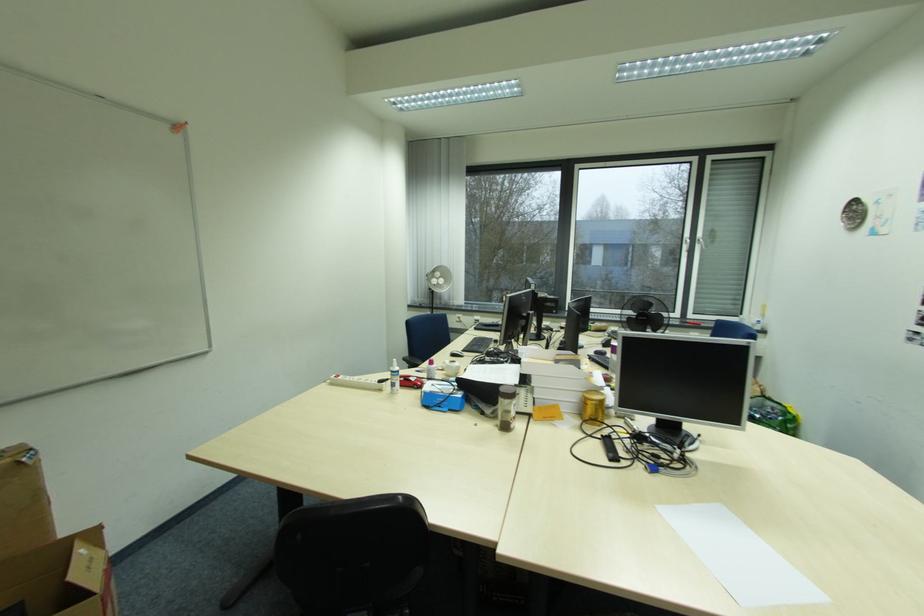
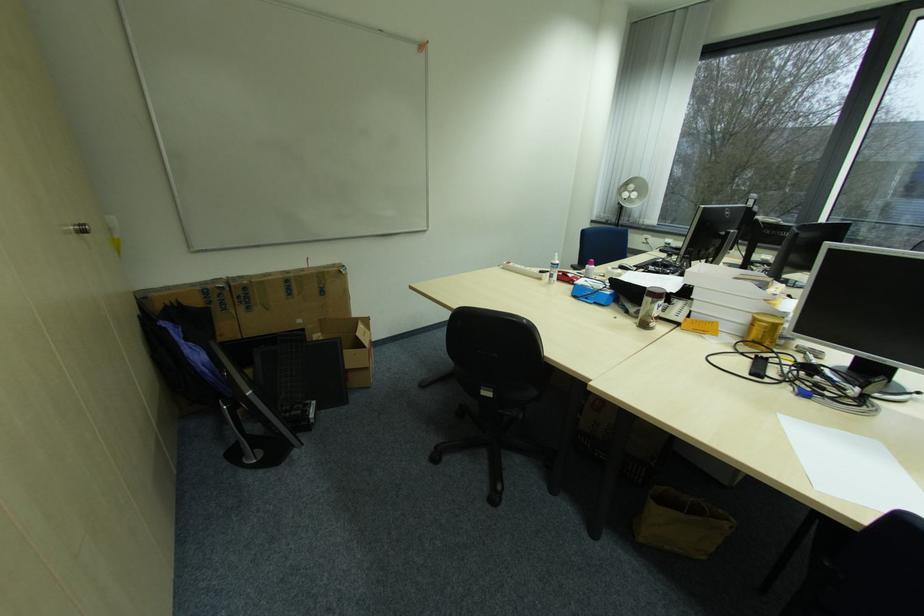
In the second image, find the point that corresponds to (395,381) in the first image.

(555, 273)